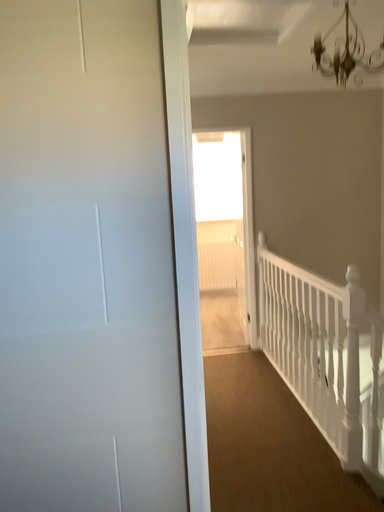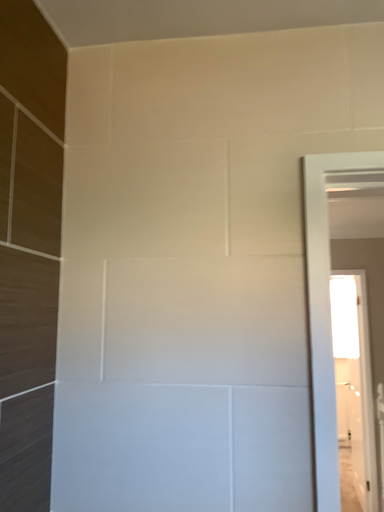
Question: Which way did the camera rotate in the video?

Choices:
 (A) rotated right
 (B) rotated left

Answer: (B)